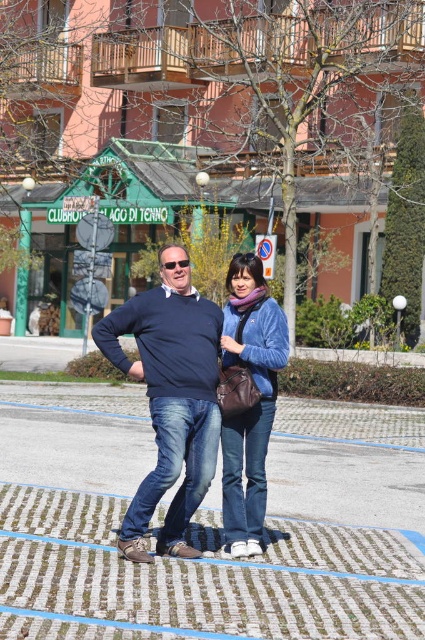
Does matte blue sweater at center have a smaller size compared to matte brown leather jacket at center?

Incorrect, matte blue sweater at center is not smaller in size than matte brown leather jacket at center.

You are a GUI agent. You are given a task and a screenshot of the screen. Output one action in this format:
    pyautogui.click(x=<x>, y=<y>)
    Task: Click on the matte blue sweater at center
    The width and height of the screenshot is (425, 640).
    Given the screenshot: What is the action you would take?
    pyautogui.click(x=170, y=401)

In order to click on matte brown leather jacket at center in this screenshot , I will do `click(248, 400)`.

Consider the image. Who is more distant from viewer, (248, 268) or (175, 262)?

The point (248, 268) is more distant.

Identify the location of matte brown leather jacket at center. This screenshot has width=425, height=640. (248, 400).

Which of these two, matte blue sweater at center or matte plastic goggles at center, stands shorter?

Standing shorter between the two is matte plastic goggles at center.

Between point (153, 484) and point (178, 260), which one is positioned behind?

Positioned behind is point (178, 260).

Find the location of a particular element. The height and width of the screenshot is (640, 425). matte blue sweater at center is located at coordinates (170, 401).